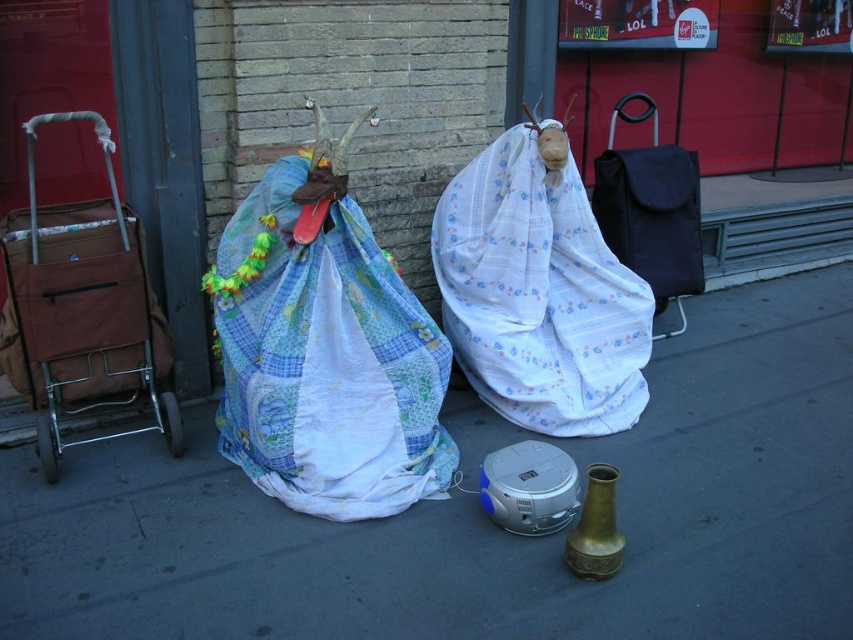
What object is located at the coordinates point (x=538, y=291)?

The point (x=538, y=291) corresponds to the white floral fabric at center.

You are a delivery person who needs to place a large package between the white floral fabric at center and the brown fabric cart at left. Can you fit it there?

The white floral fabric at center is wider than the brown fabric cart at left, so there might be enough space to fit the large package between them.